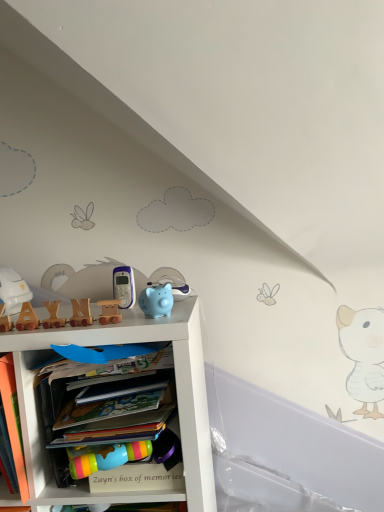
This screenshot has width=384, height=512. What do you see at coordinates (13, 291) in the screenshot? I see `white matte helmet at left, marked as the 7th toy in a right-to-left arrangement` at bounding box center [13, 291].

This screenshot has height=512, width=384. What do you see at coordinates (109, 311) in the screenshot? I see `wooden train at center, the 3th toy when ordered from right to left` at bounding box center [109, 311].

Locate an element on the screen. The image size is (384, 512). wooden train at center, arranged as the fourth toy when viewed from the right is located at coordinates (81, 313).

Find the location of a particular element. This screenshot has width=384, height=512. wooden train at center, arranged as the fifth toy when viewed from the right is located at coordinates (53, 315).

Find the location of a particular element. The height and width of the screenshot is (512, 384). white matte shelf at center is located at coordinates (176, 392).

From a real-world perspective, is white matte shelf at center positioned above or below white matte helmet at left, marked as the 7th toy in a right-to-left arrangement?

From a real-world perspective, white matte shelf at center is physically below white matte helmet at left, marked as the 7th toy in a right-to-left arrangement.

How different are the orientations of white matte shelf at center and white matte helmet at left, marked as the 7th toy in a right-to-left arrangement, in degrees?

The angular difference between white matte shelf at center and white matte helmet at left, marked as the 7th toy in a right-to-left arrangement, is 0.934 degrees.

Does white matte shelf at center have a lesser width compared to white matte helmet at left, marked as the 7th toy in a right-to-left arrangement?

In fact, white matte shelf at center might be wider than white matte helmet at left, marked as the 7th toy in a right-to-left arrangement.

You are a GUI agent. You are given a task and a screenshot of the screen. Output one action in this format:
    pyautogui.click(x=<x>, y=<y>)
    Task: Click on the 6th toy behind the white matte shelf at center
    
    Given the screenshot: What is the action you would take?
    pyautogui.click(x=13, y=291)

From the image's perspective, does wooden train at center, the fourth toy when ordered from left to right, appear lower than wooden train at center, the third toy from the left?

No, from the image's perspective, wooden train at center, the fourth toy when ordered from left to right, is not beneath wooden train at center, the third toy from the left.

Considering the positions of points (83, 325) and (50, 318), is point (83, 325) farther from camera compared to point (50, 318)?

No, (83, 325) is closer to viewer.

Looking at this image, who is bigger, wooden train at center, arranged as the fourth toy when viewed from the right, or wooden train at center, the third toy from the left?

wooden train at center, arranged as the fourth toy when viewed from the right, is bigger.

Is wooden train at center, the fourth toy when ordered from left to right, located outside white matte helmet at left, positioned as the 1th toy in left-to-right order?

Yes, wooden train at center, the fourth toy when ordered from left to right, is located beyond the bounds of white matte helmet at left, positioned as the 1th toy in left-to-right order.

Considering the relative positions of wooden train at center, arranged as the fourth toy when viewed from the right, and white matte helmet at left, marked as the 7th toy in a right-to-left arrangement, in the image provided, is wooden train at center, arranged as the fourth toy when viewed from the right, to the right of white matte helmet at left, marked as the 7th toy in a right-to-left arrangement, from the viewer's perspective?

Correct, you'll find wooden train at center, arranged as the fourth toy when viewed from the right, to the right of white matte helmet at left, marked as the 7th toy in a right-to-left arrangement.

Consider the image. From a real-world perspective, who is located lower, wooden train at center, the fourth toy when ordered from left to right, or white matte helmet at left, positioned as the 1th toy in left-to-right order?

wooden train at center, the fourth toy when ordered from left to right, is physically lower.

Does wooden train at center, the fourth toy when ordered from left to right, turn towards white matte helmet at left, marked as the 7th toy in a right-to-left arrangement?

No.

Can you confirm if orange matte book at lower left is smaller than wooden train at center, the 3th toy when ordered from right to left?

Incorrect, orange matte book at lower left is not smaller in size than wooden train at center, the 3th toy when ordered from right to left.

Considering the relative sizes of orange matte book at lower left and wooden train at center, the 3th toy when ordered from right to left, in the image provided, is orange matte book at lower left wider than wooden train at center, the 3th toy when ordered from right to left,?

Yes.

Is wooden train at center, which appears as the 5th toy when viewed from the left, at the back of orange matte book at lower left?

No, orange matte book at lower left is not facing away from wooden train at center, which appears as the 5th toy when viewed from the left.

Who is taller, white matte helmet at left, marked as the 7th toy in a right-to-left arrangement, or matte plastic phone at center, the second toy viewed from the right?

With more height is white matte helmet at left, marked as the 7th toy in a right-to-left arrangement.

In terms of width, does white matte helmet at left, marked as the 7th toy in a right-to-left arrangement, look wider or thinner when compared to matte plastic phone at center, the second toy viewed from the right?

In the image, white matte helmet at left, marked as the 7th toy in a right-to-left arrangement, appears to be wider than matte plastic phone at center, the second toy viewed from the right.

Is white matte helmet at left, positioned as the 1th toy in left-to-right order, inside the boundaries of matte plastic phone at center, the second toy viewed from the right, or outside?

white matte helmet at left, positioned as the 1th toy in left-to-right order, exists outside the volume of matte plastic phone at center, the second toy viewed from the right.

Is wooden train at center, arranged as the fourth toy when viewed from the right, surrounded by matte blue piggy bank at center, acting as the seventh toy starting from the left?

That's incorrect, wooden train at center, arranged as the fourth toy when viewed from the right, is not inside matte blue piggy bank at center, acting as the seventh toy starting from the left.

This screenshot has height=512, width=384. Identify the location of the 1st toy located above the wooden train at center, arranged as the fourth toy when viewed from the right (from a real-world perspective). (156, 300).

Looking at this image, considering the sizes of matte blue piggy bank at center, acting as the seventh toy starting from the left, and wooden train at center, arranged as the fourth toy when viewed from the right, in the image, is matte blue piggy bank at center, acting as the seventh toy starting from the left, taller or shorter than wooden train at center, arranged as the fourth toy when viewed from the right,?

Considering their sizes, matte blue piggy bank at center, acting as the seventh toy starting from the left, has more height than wooden train at center, arranged as the fourth toy when viewed from the right.

Is there a large distance between matte blue piggy bank at center, positioned as the first toy in right-to-left order, and wooden train at center, arranged as the fourth toy when viewed from the right?

No, matte blue piggy bank at center, positioned as the first toy in right-to-left order, is not far from wooden train at center, arranged as the fourth toy when viewed from the right.

Is matte blue piggy bank at center, positioned as the first toy in right-to-left order, turned away from wooden train at center, arranged as the fifth toy when viewed from the right?

No, matte blue piggy bank at center, positioned as the first toy in right-to-left order, is not facing the opposite direction of wooden train at center, arranged as the fifth toy when viewed from the right.

Measure the distance between matte blue piggy bank at center, positioned as the first toy in right-to-left order, and wooden train at center, the third toy from the left.

matte blue piggy bank at center, positioned as the first toy in right-to-left order, and wooden train at center, the third toy from the left, are 8.67 inches apart from each other.

From a real-world perspective, which toy is the 2nd one underneath the matte blue piggy bank at center, acting as the seventh toy starting from the left? Please provide its 2D coordinates.

[(53, 315)]

At what (x,y) coordinates should I click in order to perform the action: click on the 7th toy located above the white matte shelf at center (from a real-world perspective). Please return your answer as a coordinate pair (x, y). Looking at the image, I should click on (13, 291).

There is a wooden train at center, arranged as the fourth toy when viewed from the right. Identify the location of the 1st toy below it (from a real-world perspective). (53, 315).

When comparing their distances from white matte shelf at center, does wooden train at center, the 3th toy when ordered from right to left, or wooden train at center, arranged as the fifth toy when viewed from the right, seem closer?

The object closer to white matte shelf at center is wooden train at center, the 3th toy when ordered from right to left.

Looking at the image, which one is located further to wooden letter blocks at upper left, the sixth toy in the right-to-left sequence, matte blue piggy bank at center, acting as the seventh toy starting from the left, or matte plastic phone at center, the sixth toy viewed from the left?

matte blue piggy bank at center, acting as the seventh toy starting from the left, is further to wooden letter blocks at upper left, the sixth toy in the right-to-left sequence.

Which object lies further to the anchor point matte blue piggy bank at center, positioned as the first toy in right-to-left order, wooden letter blocks at upper left, the sixth toy in the right-to-left sequence, or white matte helmet at left, marked as the 7th toy in a right-to-left arrangement?

white matte helmet at left, marked as the 7th toy in a right-to-left arrangement, lies further to matte blue piggy bank at center, positioned as the first toy in right-to-left order, than the other object.

Estimate the real-world distances between objects in this image. Which object is further from matte plastic phone at center, the second toy viewed from the right, wooden train at center, the third toy from the left, or white matte shelf at center?

white matte shelf at center lies further to matte plastic phone at center, the second toy viewed from the right, than the other object.

From the image, which object appears to be farther from wooden letter blocks at upper left, which is the 2th toy in left-to-right order, matte blue piggy bank at center, positioned as the first toy in right-to-left order, or wooden train at center, arranged as the fourth toy when viewed from the right?

Based on the image, matte blue piggy bank at center, positioned as the first toy in right-to-left order, appears to be further to wooden letter blocks at upper left, which is the 2th toy in left-to-right order.

Considering their positions, is white matte helmet at left, marked as the 7th toy in a right-to-left arrangement, positioned closer to wooden letter blocks at upper left, which is the 2th toy in left-to-right order, than wooden train at center, the fourth toy when ordered from left to right?

wooden train at center, the fourth toy when ordered from left to right, is positioned closer to the anchor wooden letter blocks at upper left, which is the 2th toy in left-to-right order.

When comparing their distances from matte plastic phone at center, the second toy viewed from the right, does wooden train at center, the 3th toy when ordered from right to left, or white matte helmet at left, marked as the 7th toy in a right-to-left arrangement, seem closer?

Based on the image, wooden train at center, the 3th toy when ordered from right to left, appears to be nearer to matte plastic phone at center, the second toy viewed from the right.

Looking at the image, which one is located closer to white matte shelf at center, white matte helmet at left, marked as the 7th toy in a right-to-left arrangement, or wooden letter blocks at upper left, which is the 2th toy in left-to-right order?

The object closer to white matte shelf at center is wooden letter blocks at upper left, which is the 2th toy in left-to-right order.

Where is `shelf situated between white matte helmet at left, positioned as the 1th toy in left-to-right order, and matte blue piggy bank at center, acting as the seventh toy starting from the left, from left to right`? This screenshot has height=512, width=384. shelf situated between white matte helmet at left, positioned as the 1th toy in left-to-right order, and matte blue piggy bank at center, acting as the seventh toy starting from the left, from left to right is located at coordinates (176, 392).

Locate an element on the screen. This screenshot has width=384, height=512. toy between wooden train at center, arranged as the fifth toy when viewed from the right, and wooden train at center, which appears as the 5th toy when viewed from the left, in the horizontal direction is located at coordinates (81, 313).

Where is `book between white matte helmet at left, marked as the 7th toy in a right-to-left arrangement, and matte plastic phone at center, the sixth toy viewed from the left, in the horizontal direction`? The width and height of the screenshot is (384, 512). book between white matte helmet at left, marked as the 7th toy in a right-to-left arrangement, and matte plastic phone at center, the sixth toy viewed from the left, in the horizontal direction is located at coordinates (13, 421).

At what (x,y) coordinates should I click in order to perform the action: click on toy between wooden train at center, arranged as the fifth toy when viewed from the right, and orange matte book at lower left vertically. Please return your answer as a coordinate pair (x, y). Looking at the image, I should click on (27, 318).